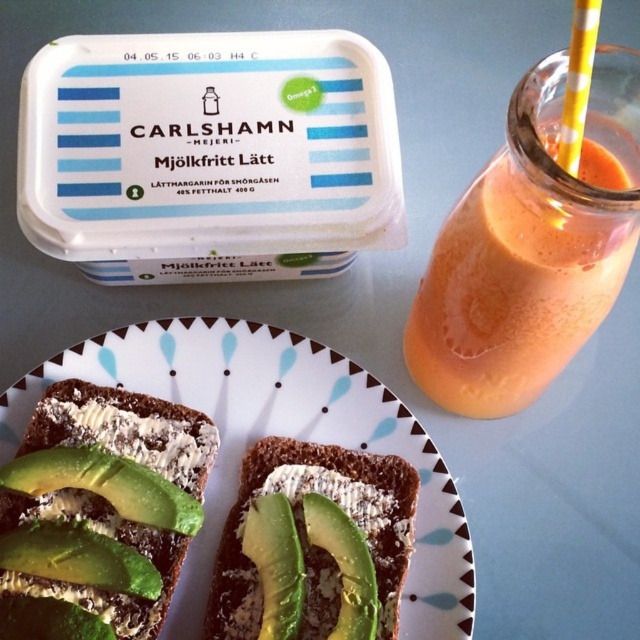
Question: Which of the following is the farthest from the observer?

Choices:
 (A) white ceramic plate at center
 (B) green avocado toast at lower center
 (C) green avocado toast at center

Answer: (A)

Question: Which of these objects is positioned closest to the green avocado toast at lower center?

Choices:
 (A) white ceramic plate at center
 (B) green avocado toast at center
 (C) orange smoothie at upper right

Answer: (A)

Question: Estimate the real-world distances between objects in this image. Which object is closer to the green avocado toast at lower center?

Choices:
 (A) green avocado toast at center
 (B) orange smoothie at upper right
 (C) white ceramic plate at center

Answer: (C)

Question: Is white ceramic plate at center wider than green avocado toast at lower center?

Choices:
 (A) yes
 (B) no

Answer: (A)

Question: Is orange smoothie at upper right behind green avocado toast at lower center?

Choices:
 (A) no
 (B) yes

Answer: (A)

Question: From the image, what is the correct spatial relationship of orange smoothie at upper right in relation to green avocado toast at center?

Choices:
 (A) above
 (B) below

Answer: (A)